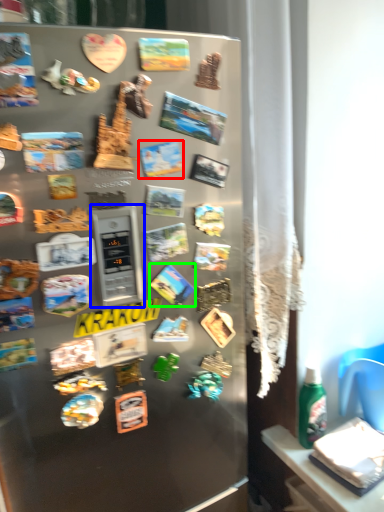
Question: Considering the real-world distances, which object is closest to comic book (highlighted by a red box)? appliance (highlighted by a blue box) or comic book (highlighted by a green box).

Choices:
 (A) appliance
 (B) comic book

Answer: (A)